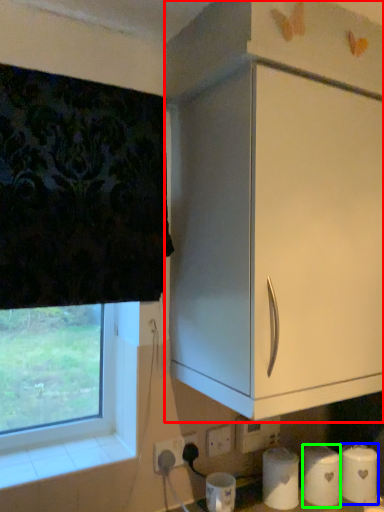
Question: Which object is the closest to the cabinetry (highlighted by a red box)? Choose among these: toilet paper (highlighted by a blue box) or toilet paper (highlighted by a green box).

Choices:
 (A) toilet paper
 (B) toilet paper

Answer: (B)